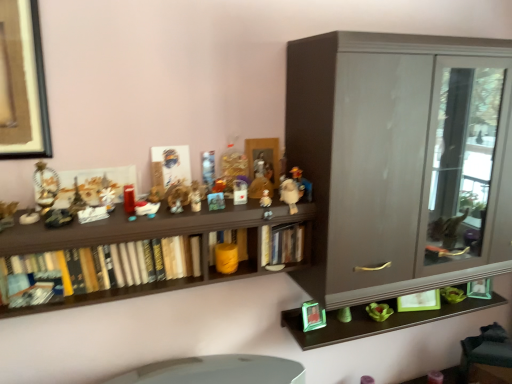
Measure the distance between point (42, 128) and camera.

Point (42, 128) and camera are 4.51 feet apart.

Looking at this image, in order to face matte black picture frame at upper left, should I rotate leftwards or rightwards?

To align with it, rotate left about 29.062°.

In the scene shown: Measure the distance between wooden figurine at center, arranged as the 8th toy when viewed from the right, and camera.

wooden figurine at center, arranged as the 8th toy when viewed from the right, and camera are 4.63 feet apart from each other.

Based on the photo, in order to face wooden figurine at center, which is the fifth toy from left to right, should I rotate leftwards or rightwards?

A 8.272 degree turn to the left will do.

Describe the element at coordinates (149, 265) in the screenshot. Image resolution: width=512 pixels, height=384 pixels. I see `hardcover books at center left, the 1th book in the left-to-right sequence` at that location.

This screenshot has height=384, width=512. What are the coordinates of `metallic silver toy at center, placed as the 11th toy when sorted from right to left` in the screenshot? It's located at (106, 197).

Describe the element at coordinates (226, 258) in the screenshot. I see `matte yellow toy at center, which ranks as the 8th toy in left-to-right order` at that location.

Find the location of a particular element. This screenshot has width=512, height=384. brown wooden shelf at upper center is located at coordinates (165, 76).

Image resolution: width=512 pixels, height=384 pixels. I want to click on matte black picture frame at upper left, so click(22, 83).

Is green plastic frame at lower right, acting as the 2th toy starting from the right, oriented away from matte plastic figurine at center, the ninth toy from the right?

That's not correct — green plastic frame at lower right, acting as the 2th toy starting from the right, is not looking away from matte plastic figurine at center, the ninth toy from the right.

Are green plastic frame at lower right, acting as the 2th toy starting from the right, and matte plastic figurine at center, the ninth toy from the right, far apart?

green plastic frame at lower right, acting as the 2th toy starting from the right, is actually quite close to matte plastic figurine at center, the ninth toy from the right.

Considering their positions, is green plastic frame at lower right, acting as the 2th toy starting from the right, located in front of or behind matte plastic figurine at center, the ninth toy from the right?

Visually, green plastic frame at lower right, acting as the 2th toy starting from the right, is located behind matte plastic figurine at center, the ninth toy from the right.

From the image's perspective, between green plastic frame at lower right, the 11th toy when ordered from left to right, and matte plastic figurine at center, which is counted as the fourth toy, starting from the left, which one is located above?

matte plastic figurine at center, which is counted as the fourth toy, starting from the left.

The width and height of the screenshot is (512, 384). What are the coordinates of `the 9th toy positioned below the metallic silver toy at center, which is the sixth toy from left to right (from a real-world perspective)` in the screenshot? It's located at (226, 258).

Who is shorter, matte yellow toy at center, placed as the fifth toy when sorted from right to left, or metallic silver toy at center, which is the sixth toy from left to right?

matte yellow toy at center, placed as the fifth toy when sorted from right to left.

From the image's perspective, who appears lower, matte yellow toy at center, placed as the fifth toy when sorted from right to left, or metallic silver toy at center, the 7th toy viewed from the right?

matte yellow toy at center, placed as the fifth toy when sorted from right to left, appears lower in the image.

Looking at this image, is metallic silver toy at center, the 7th toy viewed from the right, at the back of matte yellow toy at center, which ranks as the 8th toy in left-to-right order?

No, matte yellow toy at center, which ranks as the 8th toy in left-to-right order,'s orientation is not away from metallic silver toy at center, the 7th toy viewed from the right.

From a real-world perspective, who is located higher, matte plastic cup at center, which is counted as the third toy, starting from the left, or green plastic frame at lower right, the 11th toy when ordered from left to right?

From a 3D spatial view, matte plastic cup at center, which is counted as the third toy, starting from the left, is above.

Is point (126, 185) positioned before point (304, 317)?

Yes, point (126, 185) is in front of point (304, 317).

Is matte plastic cup at center, which is counted as the third toy, starting from the left, smaller than green plastic frame at lower right, acting as the 2th toy starting from the right?

Yes, matte plastic cup at center, which is counted as the third toy, starting from the left, is smaller than green plastic frame at lower right, acting as the 2th toy starting from the right.

Is matte plastic cup at center, which is counted as the third toy, starting from the left, at the right side of green plastic frame at lower right, the 11th toy when ordered from left to right?

No, matte plastic cup at center, which is counted as the third toy, starting from the left, is not to the right of green plastic frame at lower right, the 11th toy when ordered from left to right.

Is brown wooden shelf at upper center turned away from metallic silver toy at center, positioned as the second toy in left-to-right order?

Absolutely, brown wooden shelf at upper center is directed away from metallic silver toy at center, positioned as the second toy in left-to-right order.

Is metallic silver toy at center, positioned as the second toy in left-to-right order, completely or partially inside brown wooden shelf at upper center?

No, metallic silver toy at center, positioned as the second toy in left-to-right order, is located outside of brown wooden shelf at upper center.

In the scene shown: From the image's perspective, between brown wooden shelf at upper center and metallic silver toy at center, positioned as the second toy in left-to-right order, which one is located above?

metallic silver toy at center, positioned as the second toy in left-to-right order.

Can you confirm if brown wooden shelf at upper center is bigger than metallic silver toy at center, placed as the 11th toy when sorted from right to left?

Yes, brown wooden shelf at upper center is bigger than metallic silver toy at center, placed as the 11th toy when sorted from right to left.

Could you tell me if green matte bowl at lower right, which is the twelfth toy from left to right, is turned towards matte plastic figurine at center, the 7th toy from the left?

No, green matte bowl at lower right, which is the twelfth toy from left to right, is not turned towards matte plastic figurine at center, the 7th toy from the left.

Considering the points (384, 316) and (220, 188), which point is in front, point (384, 316) or point (220, 188)?

Point (220, 188)

Considering the relative positions of green matte bowl at lower right, which is the 1th toy in right-to-left order, and matte plastic figurine at center, the 7th toy from the left, in the image provided, is green matte bowl at lower right, which is the 1th toy in right-to-left order, to the right of matte plastic figurine at center, the 7th toy from the left, from the viewer's perspective?

Yes, green matte bowl at lower right, which is the 1th toy in right-to-left order, is to the right of matte plastic figurine at center, the 7th toy from the left.

Looking at their sizes, would you say matte plastic cup at center, arranged as the tenth toy when viewed from the right, is wider or thinner than matte yellow toy at center, placed as the fifth toy when sorted from right to left?

Considering their sizes, matte plastic cup at center, arranged as the tenth toy when viewed from the right, looks slimmer than matte yellow toy at center, placed as the fifth toy when sorted from right to left.

Where is `the 2nd toy behind the matte plastic cup at center, which is counted as the third toy, starting from the left`? The image size is (512, 384). the 2nd toy behind the matte plastic cup at center, which is counted as the third toy, starting from the left is located at coordinates (226, 258).

From the image's perspective, which one is positioned lower, matte plastic cup at center, which is counted as the third toy, starting from the left, or matte yellow toy at center, which ranks as the 8th toy in left-to-right order?

matte yellow toy at center, which ranks as the 8th toy in left-to-right order, from the image's perspective.

Which object is positioned more to the left, yellow matte bookshelf at center, positioned as the 2th book in left-to-right order, or hardcover book at center, which is counted as the 3th book, starting from the left?

Positioned to the left is yellow matte bookshelf at center, positioned as the 2th book in left-to-right order.

From a real-world perspective, is yellow matte bookshelf at center, which is the 2th book from right to left, positioned under hardcover book at center, marked as the first book in a right-to-left arrangement, based on gravity?

Yes, from a real-world perspective, yellow matte bookshelf at center, which is the 2th book from right to left, is under hardcover book at center, marked as the first book in a right-to-left arrangement.

Identify the location of the 1st book positioned below the hardcover book at center, marked as the first book in a right-to-left arrangement (from the image's perspective). The width and height of the screenshot is (512, 384). (228, 242).

From the image's perspective, starting from the matte plastic figurine at center, the ninth toy from the right, which toy is the 2nd one below? Please provide its 2D coordinates.

[(313, 316)]

Locate an element on the screen. toy that is the 9th object above the matte yellow toy at center, which ranks as the 8th toy in left-to-right order (from a real-world perspective) is located at coordinates (208, 168).

When comparing their distances from matte black picture frame at upper left, does metallic gold figurine at left, marked as the first toy in a left-to-right arrangement, or hardcover book at center, which is counted as the 3th book, starting from the left, seem closer?

metallic gold figurine at left, marked as the first toy in a left-to-right arrangement, is closer to matte black picture frame at upper left.

Which object lies nearer to the anchor point hardcover book at center, marked as the first book in a right-to-left arrangement, green matte bowl at lower right, which is the 1th toy in right-to-left order, or matte black picture frame at upper left?

Based on the image, green matte bowl at lower right, which is the 1th toy in right-to-left order, appears to be nearer to hardcover book at center, marked as the first book in a right-to-left arrangement.

Based on their spatial positions, is hardcover books at center left, the 1th book in the left-to-right sequence, or metallic silver toy at center, the 7th toy viewed from the right, further from hardcover book at center, marked as the first book in a right-to-left arrangement?

metallic silver toy at center, the 7th toy viewed from the right.

When comparing their distances from matte yellow toy at center, which ranks as the 8th toy in left-to-right order, does brown wooden shelf at upper center or fluffy white doll at center, placed as the 3th toy when sorted from right to left, seem closer?

fluffy white doll at center, placed as the 3th toy when sorted from right to left, is positioned closer to the anchor matte yellow toy at center, which ranks as the 8th toy in left-to-right order.

Looking at the image, which one is located further to matte plastic cup at center, which is counted as the third toy, starting from the left, matte gray cabinet at right or wooden figurine at center, arranged as the 8th toy when viewed from the right?

matte gray cabinet at right lies further to matte plastic cup at center, which is counted as the third toy, starting from the left, than the other object.

Which object lies nearer to the anchor point matte plastic figurine at center, the 7th toy from the left, yellow matte bookshelf at center, positioned as the 2th book in left-to-right order, or green plastic frame at lower right, the 11th toy when ordered from left to right?

The object closer to matte plastic figurine at center, the 7th toy from the left, is yellow matte bookshelf at center, positioned as the 2th book in left-to-right order.

Considering their positions, is fluffy white doll at center, placed as the 3th toy when sorted from right to left, positioned further to metallic gold figurine at left, marked as the first toy in a left-to-right arrangement, than hardcover book at center, marked as the first book in a right-to-left arrangement?

Among the two, fluffy white doll at center, placed as the 3th toy when sorted from right to left, is located further to metallic gold figurine at left, marked as the first toy in a left-to-right arrangement.

From the image, which object appears to be farther from matte black picture frame at upper left, yellow matte bookshelf at center, positioned as the 2th book in left-to-right order, or metallic silver toy at center, which is the sixth toy from left to right?

yellow matte bookshelf at center, positioned as the 2th book in left-to-right order.

This screenshot has height=384, width=512. I want to click on shelf located between fluffy white doll at center, the tenth toy when ordered from left to right, and matte gray cabinet at right in the left-right direction, so click(x=165, y=76).

At what (x,y) coordinates should I click in order to perform the action: click on book situated between white plastic toy at center, which ranks as the 9th toy in left-to-right order, and matte gray cabinet at right from left to right. Please return your answer as a coordinate pair (x, y). This screenshot has height=384, width=512. Looking at the image, I should click on (282, 244).

At what (x,y) coordinates should I click in order to perform the action: click on book located between matte plastic cup at center, arranged as the tenth toy when viewed from the right, and white plastic toy at center, marked as the 4th toy in a right-to-left arrangement, in the left-right direction. Please return your answer as a coordinate pair (x, y). The width and height of the screenshot is (512, 384). Looking at the image, I should click on (228, 242).

Where is `shelf between wooden figurine at center, arranged as the 8th toy when viewed from the right, and matte gray cabinet at right, in the horizontal direction`? The height and width of the screenshot is (384, 512). shelf between wooden figurine at center, arranged as the 8th toy when viewed from the right, and matte gray cabinet at right, in the horizontal direction is located at coordinates (165, 76).